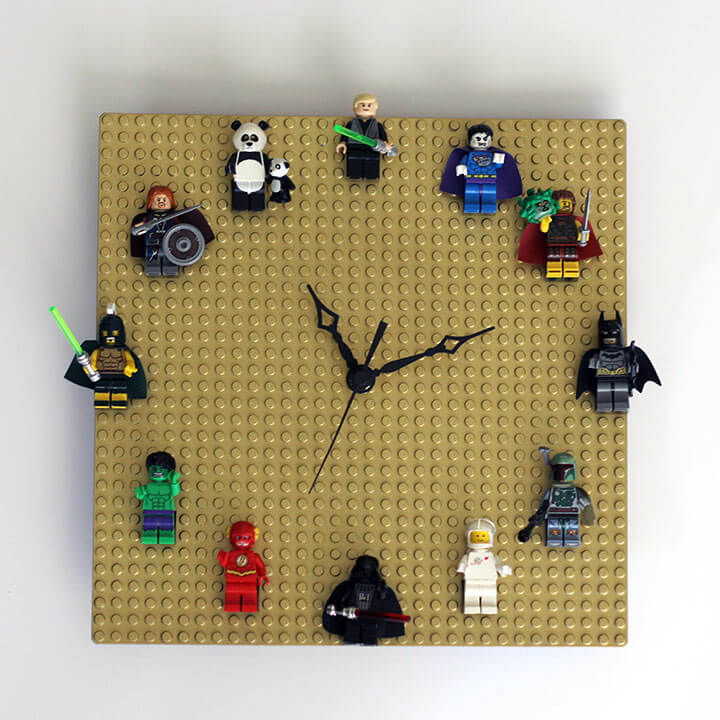
Identify the location of lego clock. (266, 364).